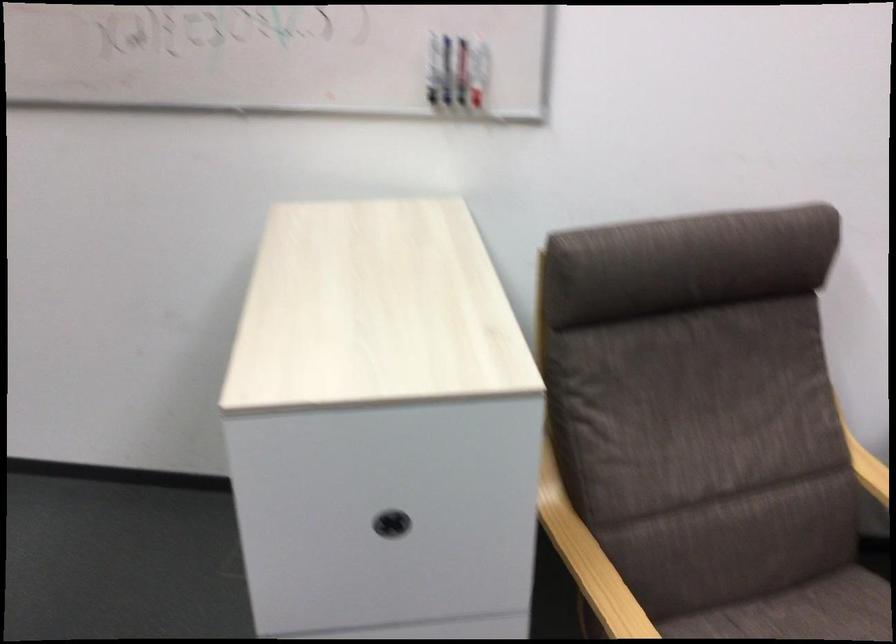
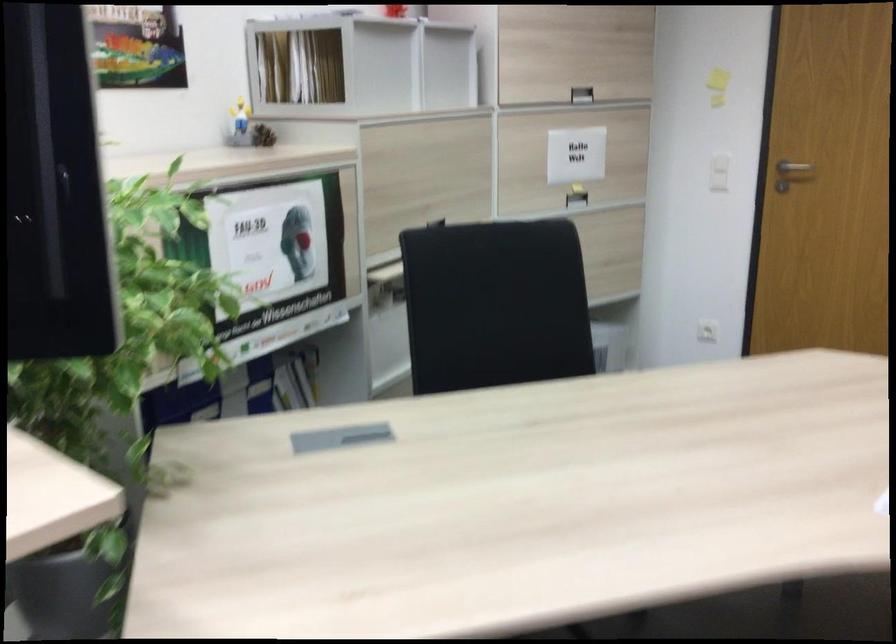
The images are taken continuously from a first-person perspective. In which direction is your viewpoint rotating?

The camera's rotation is toward left-down.